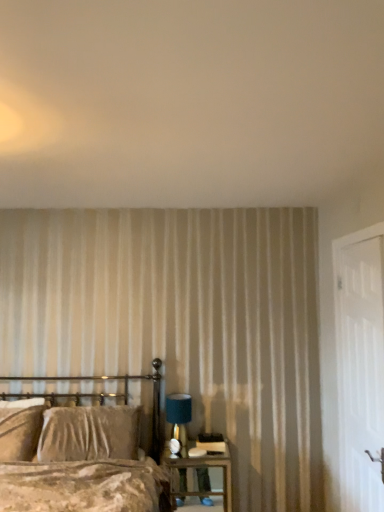
The height and width of the screenshot is (512, 384). I want to click on free point in front of teal fabric lampshade at right, so click(189, 453).